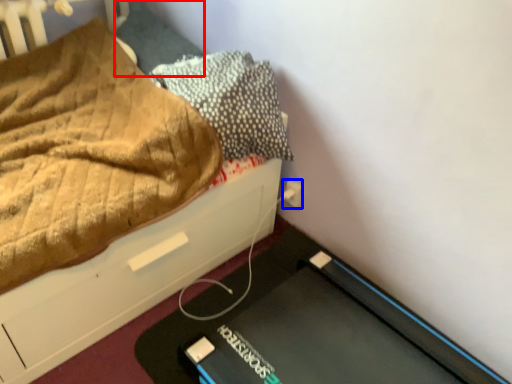
Question: Which object appears farthest to the camera in this image, pillow (highlighted by a red box) or electric outlet (highlighted by a blue box)?

Choices:
 (A) pillow
 (B) electric outlet

Answer: (B)